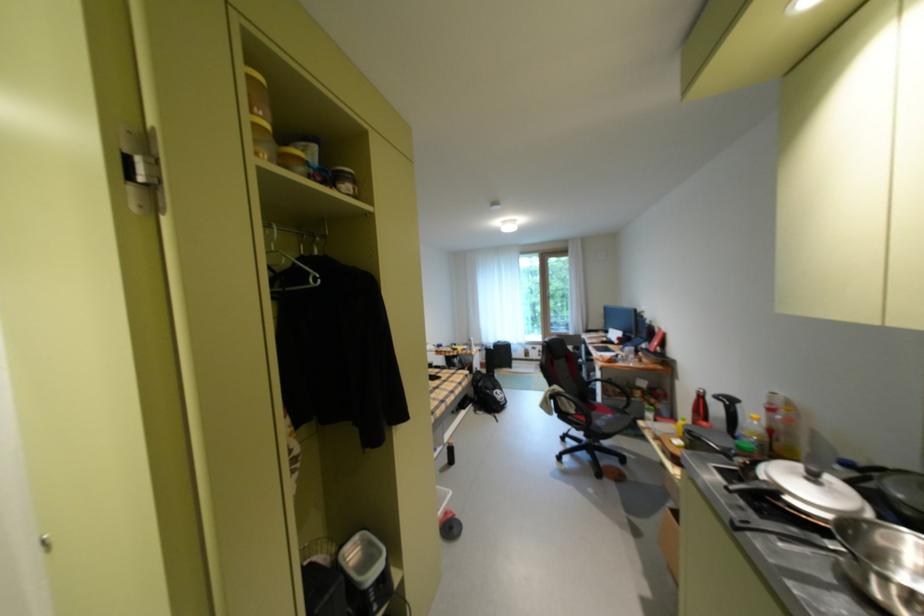
This screenshot has width=924, height=616. What do you see at coordinates (344, 180) in the screenshot? I see `a small glass jar` at bounding box center [344, 180].